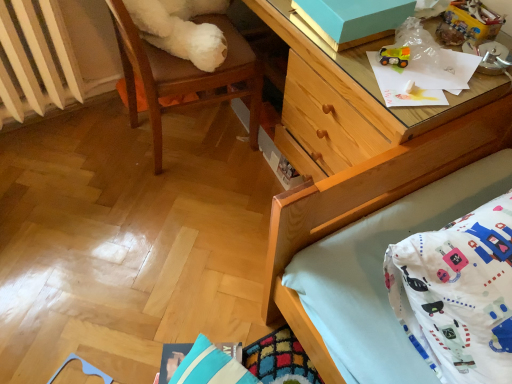
Where is `free space in front of rubberized yellow toy truck at upper right, the first toy positioned from the left`? The image size is (512, 384). free space in front of rubberized yellow toy truck at upper right, the first toy positioned from the left is located at coordinates (404, 94).